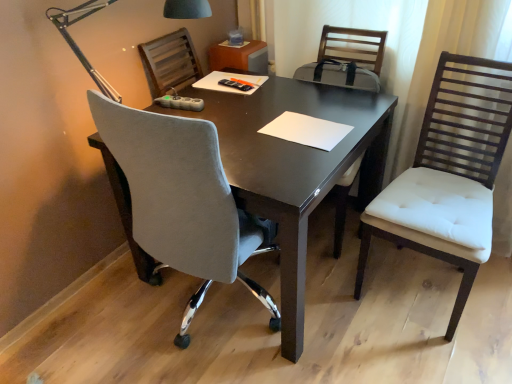
You are a GUI agent. You are given a task and a screenshot of the screen. Output one action in this format:
    pyautogui.click(x=<x>, y=<y>)
    Task: Click on the free space to the back side of white paper at center
    
    Given the screenshot: What is the action you would take?
    pyautogui.click(x=301, y=99)